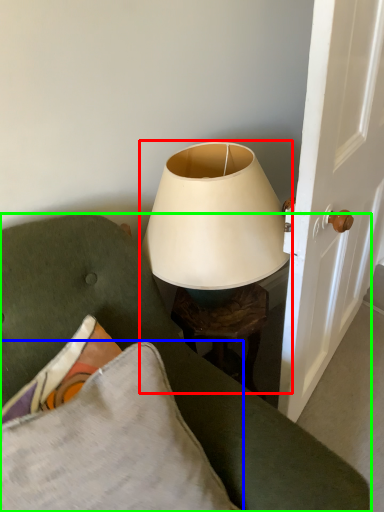
Question: Estimate the real-world distances between objects in this image. Which object is closer to lamp (highlighted by a red box), pillow (highlighted by a blue box) or furniture (highlighted by a green box)?

Choices:
 (A) pillow
 (B) furniture

Answer: (B)